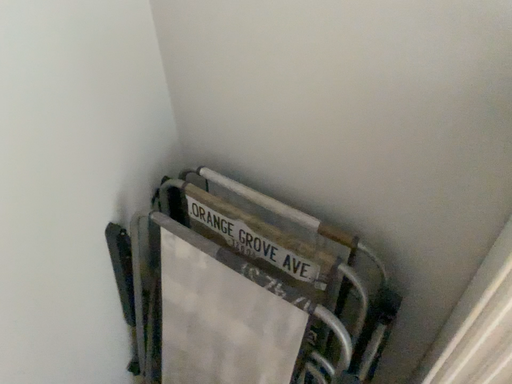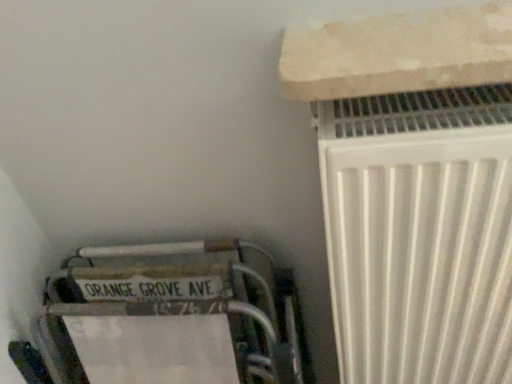
Question: Which way did the camera rotate in the video?

Choices:
 (A) rotated right
 (B) rotated left

Answer: (A)